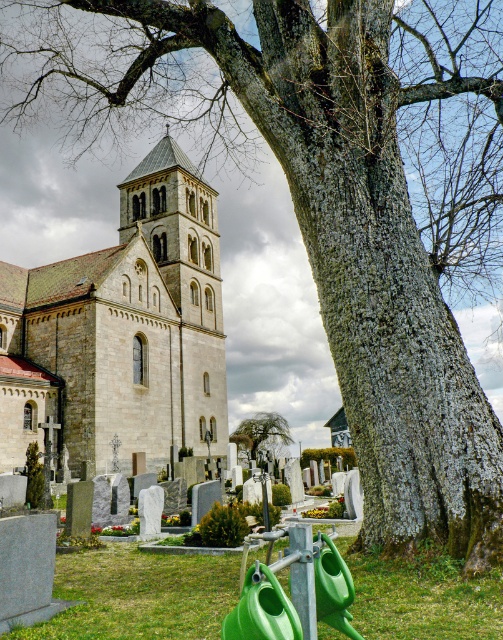
Who is positioned more to the left, stone church at center or green grass at lower center?

stone church at center

Who is more distant from viewer, (167,168) or (231,573)?

The point (167,168) is behind.

What are the coordinates of `stone church at center` in the screenshot? It's located at pyautogui.click(x=131, y=324).

Can you confirm if stone church at center is wider than green leafy tree at center?

Correct, the width of stone church at center exceeds that of green leafy tree at center.

In order to click on stone church at center in this screenshot , I will do 131,324.

From the picture: Is green grass at lower center above green leafy tree at center?

Yes, green grass at lower center is above green leafy tree at center.

Between point (117, 580) and point (253, 422), which one is positioned in front?

Positioned in front is point (117, 580).

At what (x,y) coordinates should I click in order to perform the action: click on green grass at lower center. Please return your answer as a coordinate pair (x, y). Looking at the image, I should click on (138, 595).